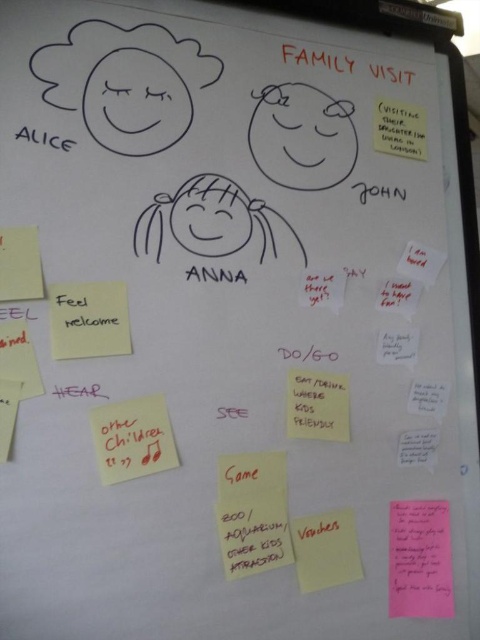
Does point (157, 436) come behind point (34, 252)?

That is True.

At what (x,y) coordinates should I click in order to perform the action: click on pink paper note at center. Please return your answer as a coordinate pair (x, y). The image size is (480, 640). Looking at the image, I should click on (132, 438).

Does yellow paper at lower left have a greater width compared to white paper note at center?

Yes, yellow paper at lower left is wider than white paper note at center.

From the picture: Between yellow paper at lower left and white paper note at center, which one appears on the left side from the viewer's perspective?

Positioned to the left is yellow paper at lower left.

Identify the location of yellow paper at lower left. (88, 320).

Where is `yellow paper at lower left`? yellow paper at lower left is located at coordinates (88, 320).

Can you confirm if yellow sticky note at left is positioned below white paper note at lower right?

Incorrect, yellow sticky note at left is not positioned below white paper note at lower right.

Is yellow sticky note at left further to the viewer compared to white paper note at lower right?

No, it is not.

The image size is (480, 640). What do you see at coordinates (20, 264) in the screenshot? I see `yellow sticky note at left` at bounding box center [20, 264].

The image size is (480, 640). I want to click on yellow sticky note at left, so click(x=20, y=264).